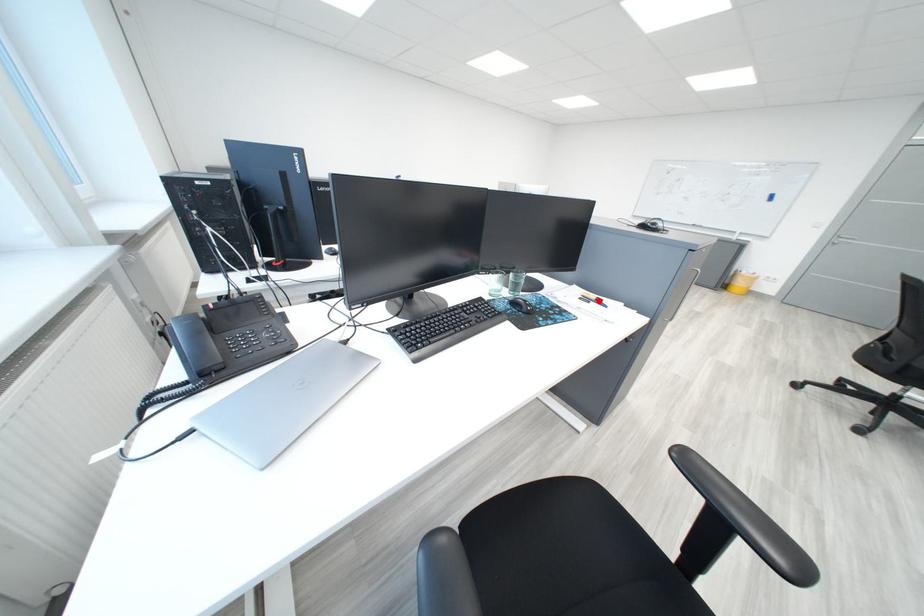
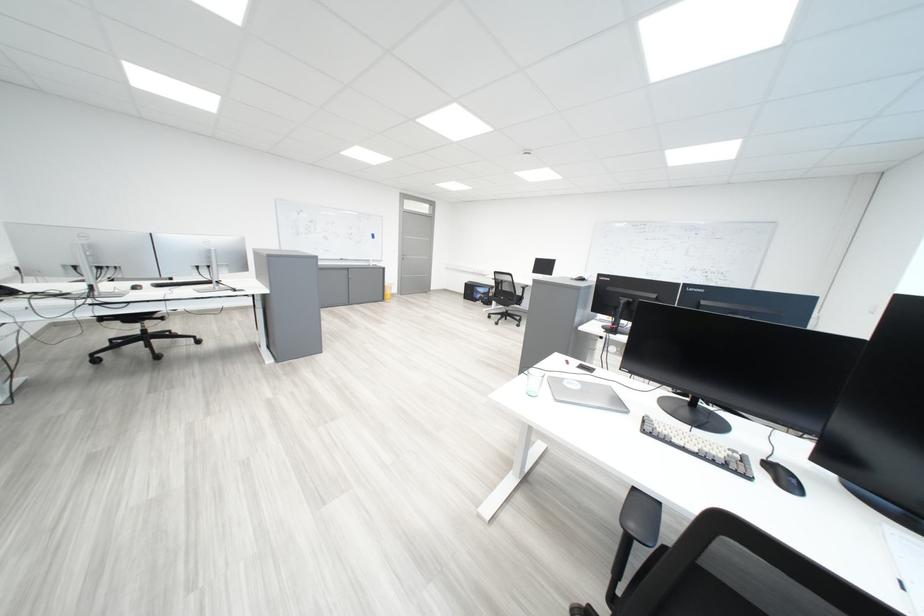
Question: I am providing you with two images of the same scene from different viewpoints. A red point is marked on the first image. Is the red point's position out of view in image 2?

Choices:
 (A) Yes
 (B) No

Answer: (A)